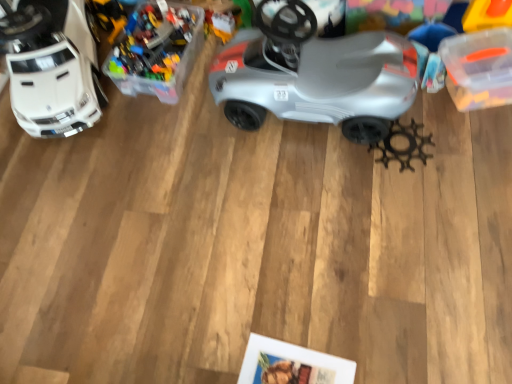
Question: Considering the relative positions of white plastic car at left, the 1th toy when ordered from left to right, and silver matte car at center in the image provided, is white plastic car at left, the 1th toy when ordered from left to right, to the left of silver matte car at center from the viewer's perspective?

Choices:
 (A) no
 (B) yes

Answer: (B)

Question: Does white plastic car at left, the 1th toy when ordered from left to right, have a greater height compared to silver matte car at center?

Choices:
 (A) yes
 (B) no

Answer: (B)

Question: Does white plastic car at left, the 1th toy when ordered from left to right, have a greater width compared to silver matte car at center?

Choices:
 (A) yes
 (B) no

Answer: (A)

Question: Is white plastic car at left, the 3th toy in the right-to-left sequence, turned away from silver matte car at center?

Choices:
 (A) yes
 (B) no

Answer: (B)

Question: Considering the relative sizes of white plastic car at left, the 3th toy in the right-to-left sequence, and silver matte car at center in the image provided, is white plastic car at left, the 3th toy in the right-to-left sequence, thinner than silver matte car at center?

Choices:
 (A) yes
 (B) no

Answer: (B)

Question: From a real-world perspective, does white plastic car at left, the 3th toy in the right-to-left sequence, stand above silver matte car at center?

Choices:
 (A) no
 (B) yes

Answer: (B)

Question: Does translucent plastic container at upper left, the 2th toy positioned from the right, have a greater width compared to silver matte car at center?

Choices:
 (A) yes
 (B) no

Answer: (A)

Question: Is translucent plastic container at upper left, acting as the second toy starting from the left, thinner than silver matte car at center?

Choices:
 (A) yes
 (B) no

Answer: (B)

Question: From the image's perspective, is translucent plastic container at upper left, acting as the second toy starting from the left, above silver matte car at center?

Choices:
 (A) no
 (B) yes

Answer: (B)

Question: Is translucent plastic container at upper left, acting as the second toy starting from the left, behind silver matte car at center?

Choices:
 (A) no
 (B) yes

Answer: (B)

Question: Is silver matte car at center at the back of translucent plastic container at upper left, acting as the second toy starting from the left?

Choices:
 (A) no
 (B) yes

Answer: (A)

Question: Is translucent plastic container at upper left, the 2th toy positioned from the right, to the left of silver matte car at center from the viewer's perspective?

Choices:
 (A) no
 (B) yes

Answer: (B)

Question: From the image's perspective, is white plastic car at left, the 3th toy in the right-to-left sequence, located above metallic gear at lower right, the 3th toy viewed from the left?

Choices:
 (A) no
 (B) yes

Answer: (B)